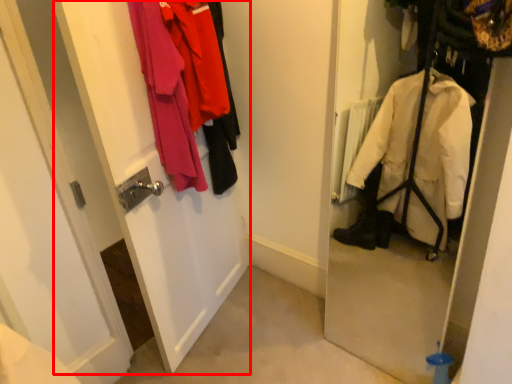
Question: From the image's perspective, where is screen door (annotated by the red box) located relative to laundry?

Choices:
 (A) below
 (B) above

Answer: (A)